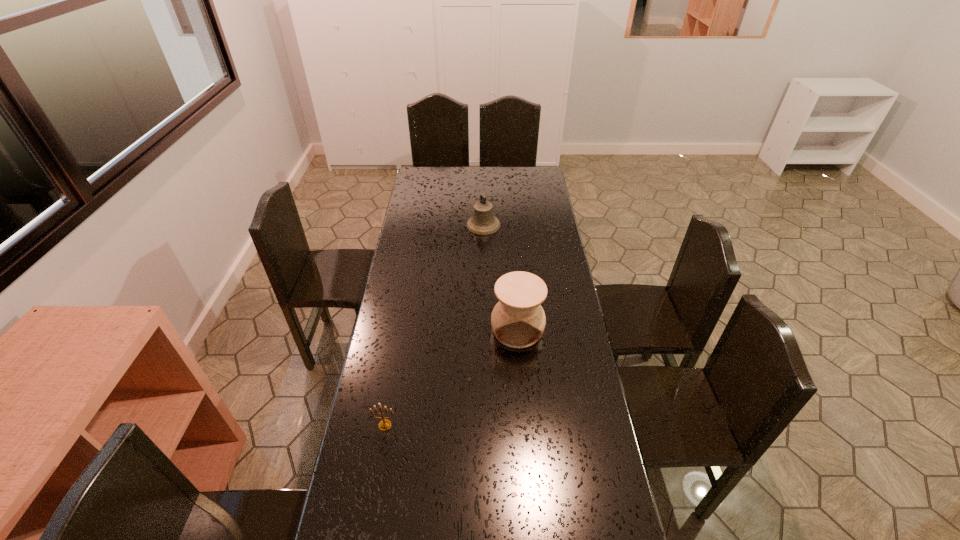
In order to click on object that can be found as the closest to the tallest object in this screenshot , I will do `click(385, 424)`.

Locate an element on the screen. vacant space that satisfies the following two spatial constraints: 1. on the back side of the farthest object; 2. on the left side of the nearest object is located at coordinates (420, 225).